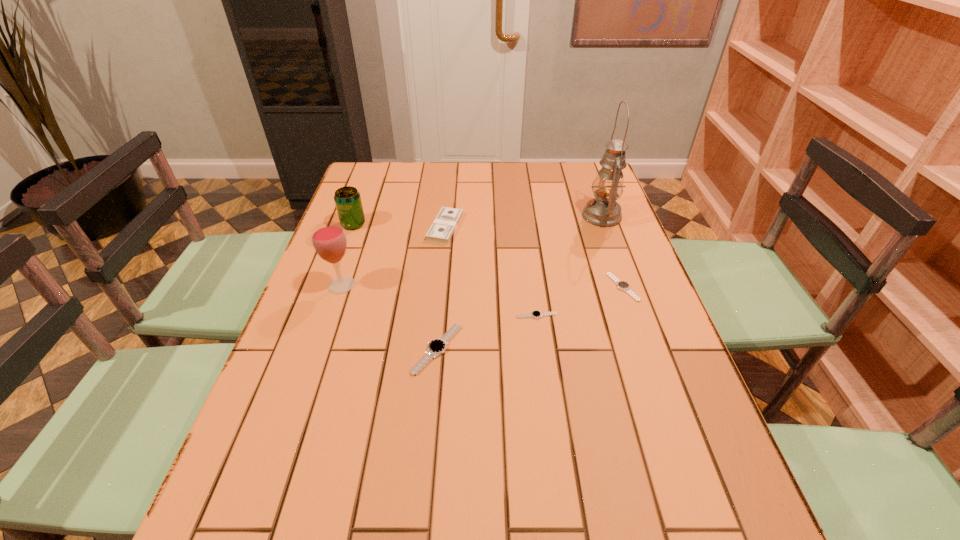
The image size is (960, 540). In order to click on the tallest watch in this screenshot , I will do `click(436, 347)`.

Find the location of a particular element. This screenshot has height=540, width=960. the leftmost watch is located at coordinates (436, 347).

The height and width of the screenshot is (540, 960). I want to click on the second nearest watch, so click(536, 314).

What are the coordinates of `the second nearest object` in the screenshot? It's located at (536, 314).

Locate an element on the screen. The width and height of the screenshot is (960, 540). the second tallest watch is located at coordinates (622, 285).

Image resolution: width=960 pixels, height=540 pixels. What are the coordinates of `the second shortest object` in the screenshot? It's located at (622, 285).

I want to click on oil lamp, so click(603, 210).

You are a GUI agent. You are given a task and a screenshot of the screen. Output one action in this format:
    pyautogui.click(x=<x>, y=<y>)
    Task: Click on the dollar
    
    Given the screenshot: What is the action you would take?
    pyautogui.click(x=444, y=225)

What are the coordinates of `beer can` in the screenshot? It's located at (347, 199).

Find the location of a particular element. wineglass is located at coordinates (329, 240).